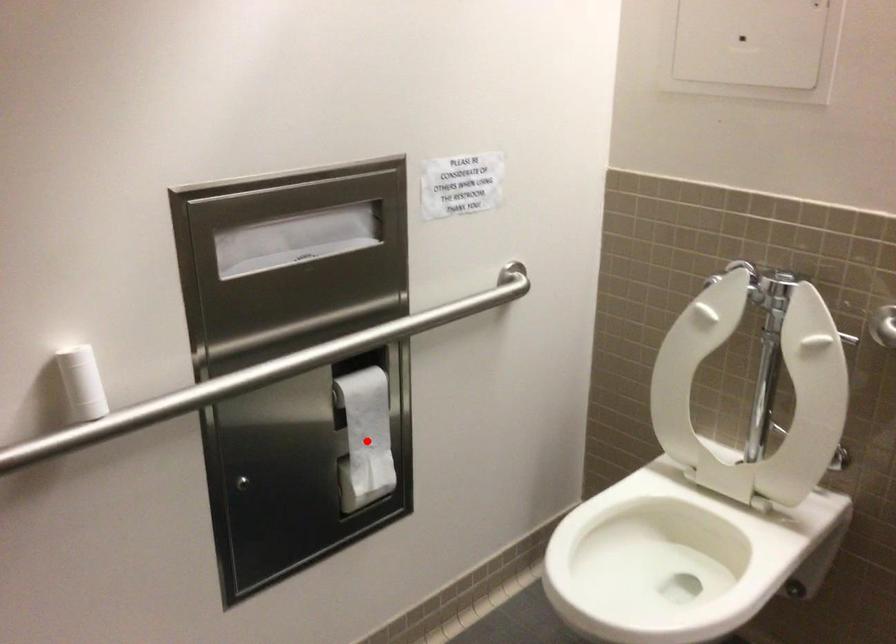
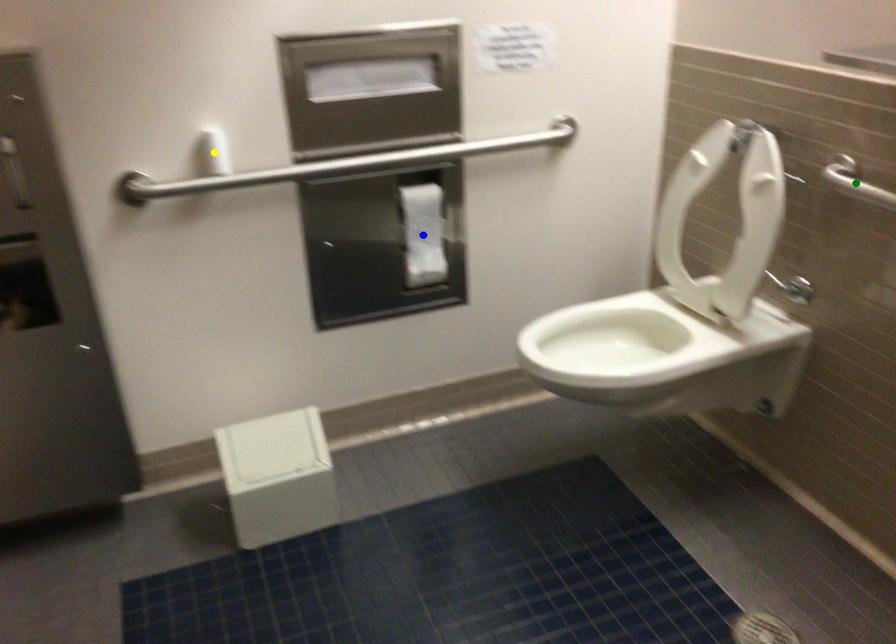
Question: I am providing you with two images of the same scene from different viewpoints. A red point is marked on the first image. You are given multiple points on the second image. Which spot in image 2 lines up with the point in image 1?

Choices:
 (A) blue point
 (B) green point
 (C) yellow point

Answer: (A)